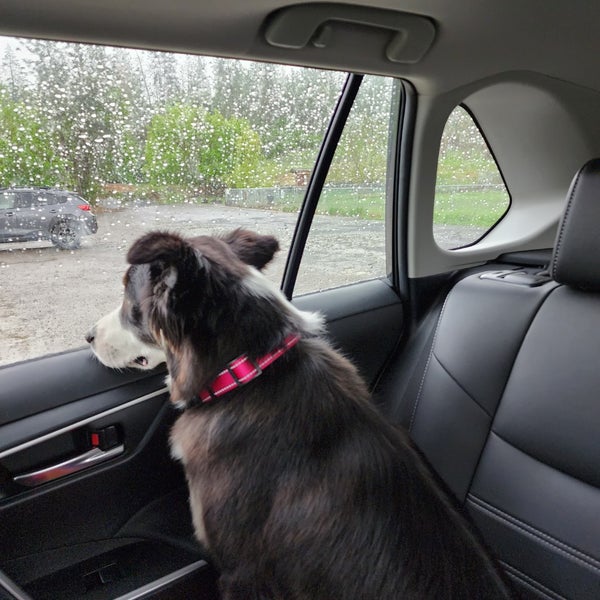
This screenshot has height=600, width=600. Find the location of `door handle`. door handle is located at coordinates (82, 461).